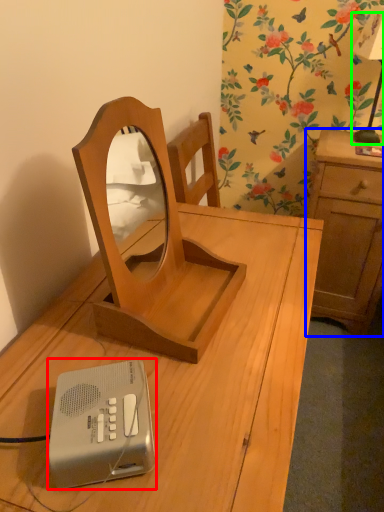
Question: Which is farther away from ipod (highlighted by a red box)? cabinetry (highlighted by a blue box) or bedside lamp (highlighted by a green box)?

Choices:
 (A) cabinetry
 (B) bedside lamp

Answer: (B)